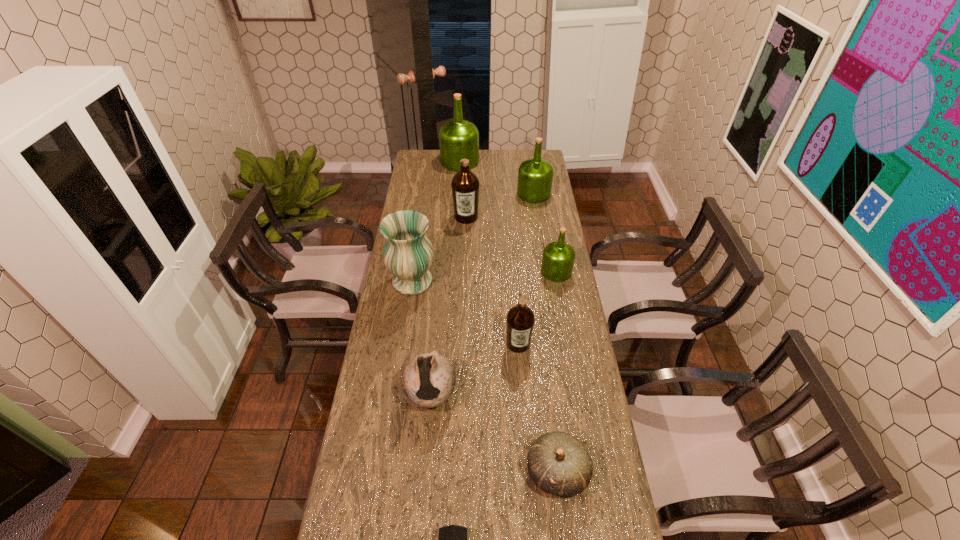
Image resolution: width=960 pixels, height=540 pixels. I want to click on blank space that satisfies the following two spatial constraints: 1. on the label of the third farthest object; 2. on the right side of the eighth tallest object, so click(457, 472).

Image resolution: width=960 pixels, height=540 pixels. Identify the location of vacant space that satisfies the following two spatial constraints: 1. on the label of the third olive oil from left to right; 2. on the left side of the eighth tallest object. (528, 472).